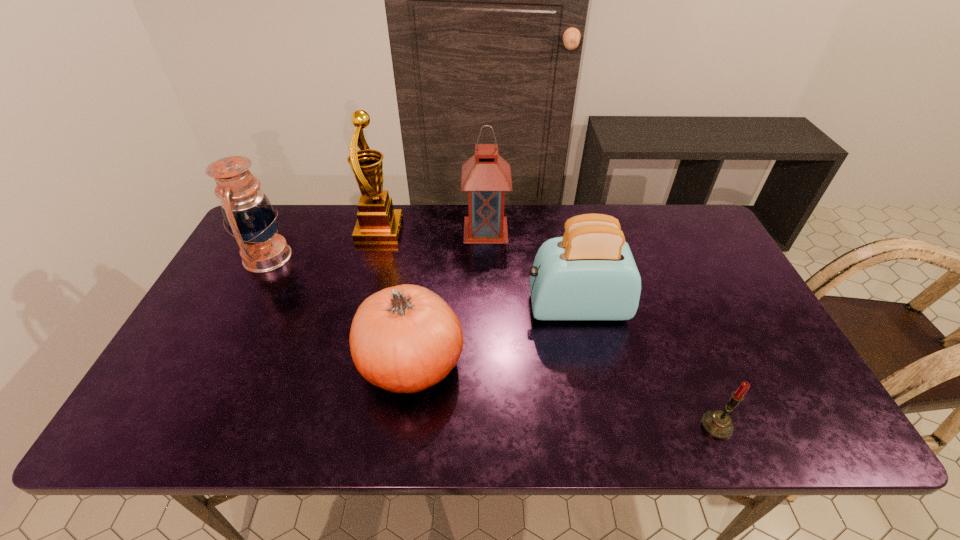
Locate an element on the screen. The height and width of the screenshot is (540, 960). vacant space that satisfies the following two spatial constraints: 1. on the front-facing side of the pumpkin; 2. on the right side of the award is located at coordinates (344, 363).